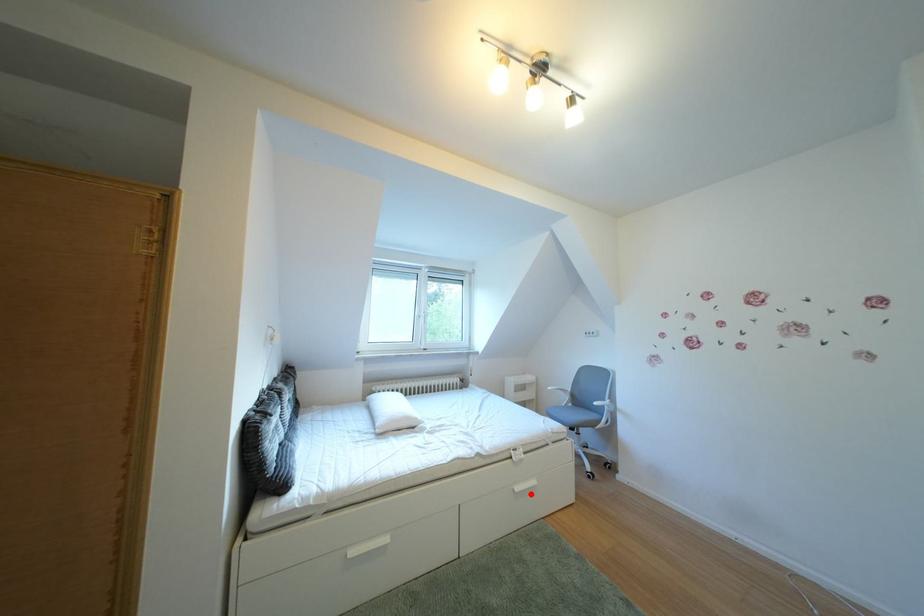
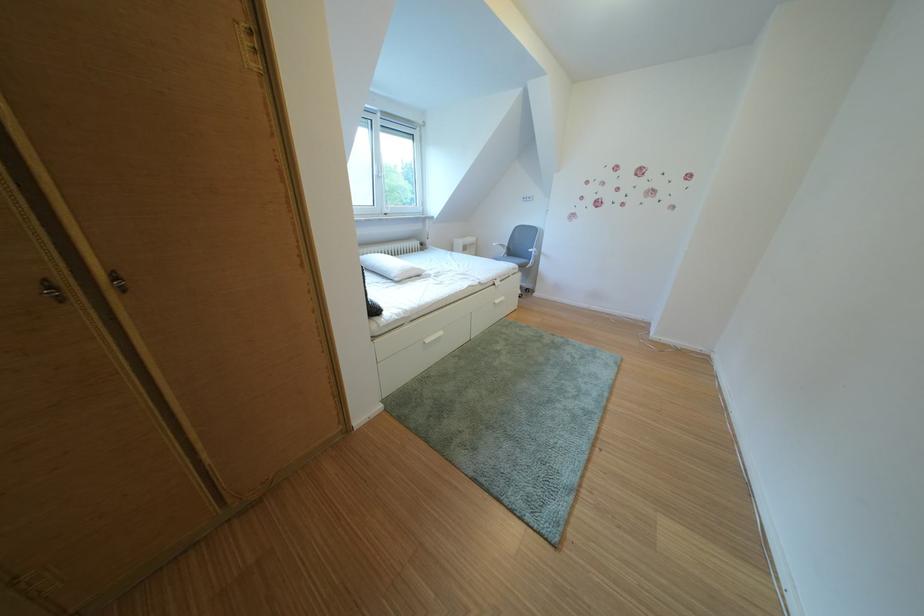
Question: I am providing you with two images of the same scene from different viewpoints. Given a red point in image1, look at the same physical point in image2. Is it:

Choices:
 (A) Closer to the viewpoint
 (B) Farther from the viewpoint

Answer: (A)